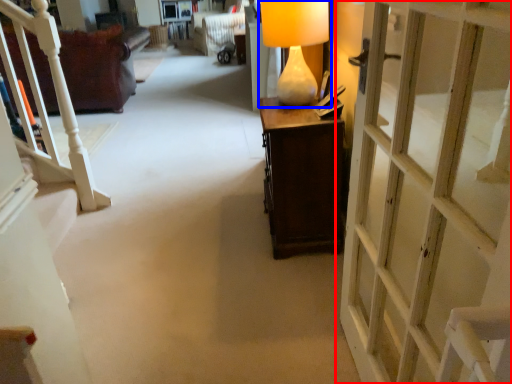
Question: Which object is further to the camera taking this photo, door (highlighted by a red box) or table lamp (highlighted by a blue box)?

Choices:
 (A) door
 (B) table lamp

Answer: (B)